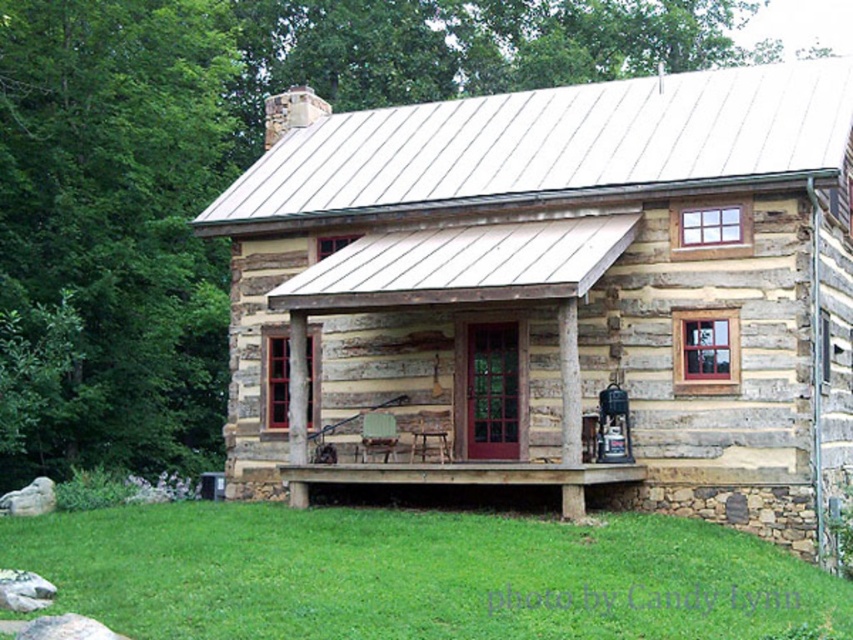
Question: Which point is farther to the camera?

Choices:
 (A) tap(538, 408)
 (B) tap(190, 593)

Answer: (A)

Question: Does weathered wood cabin at center come behind brown wooden porch at center?

Choices:
 (A) no
 (B) yes

Answer: (A)

Question: Which object is positioned closest to the weathered wood cabin at center?

Choices:
 (A) brown wooden porch at center
 (B) green grass at lower center

Answer: (A)

Question: Considering the relative positions of weathered wood cabin at center and brown wooden porch at center in the image provided, where is weathered wood cabin at center located with respect to brown wooden porch at center?

Choices:
 (A) above
 (B) below

Answer: (A)

Question: Does green grass at lower center lie behind brown wooden porch at center?

Choices:
 (A) no
 (B) yes

Answer: (A)

Question: Which object is farther from the camera taking this photo?

Choices:
 (A) brown wooden porch at center
 (B) weathered wood cabin at center

Answer: (A)